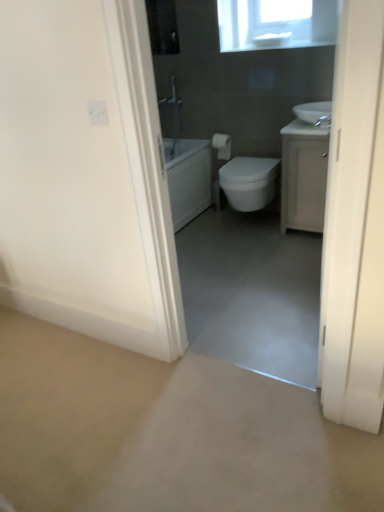
This screenshot has height=512, width=384. What do you see at coordinates (222, 146) in the screenshot?
I see `white matte toilet paper at center` at bounding box center [222, 146].

Looking at this image, measure the distance between point (284, 214) and camera.

Point (284, 214) and camera are 9.69 feet apart.

In order to face white glossy cabinet at right, should I rotate leftwards or rightwards?

It's best to rotate right around 15.674 degrees.

Where is `white matte toilet paper at center`? white matte toilet paper at center is located at coordinates (222, 146).

From the image's perspective, is white matte toilet paper at center under white glossy bidet at center?

Incorrect, from the image's perspective, white matte toilet paper at center is higher than white glossy bidet at center.

Between white matte toilet paper at center and white glossy bidet at center, which one appears on the right side from the viewer's perspective?

white glossy bidet at center is more to the right.

Is white matte toilet paper at center in front of white glossy bidet at center?

No, white matte toilet paper at center is further to the viewer.

Is point (224, 152) farther from camera compared to point (298, 149)?

Yes, point (224, 152) is farther from viewer.

Which of these two, white matte toilet paper at center or white glossy cabinet at right, stands shorter?

Standing shorter between the two is white matte toilet paper at center.

The width and height of the screenshot is (384, 512). What are the coordinates of `bathroom cabinet located on the right of white matte toilet paper at center` in the screenshot? It's located at (304, 175).

What's the angular difference between white matte toilet paper at center and white glossy cabinet at right's facing directions?

They differ by 0.498 degrees in their facing directions.

Considering the relative positions of white glossy sink at upper right and white glossy cabinet at right in the image provided, is white glossy sink at upper right to the left of white glossy cabinet at right from the viewer's perspective?

Correct, you'll find white glossy sink at upper right to the left of white glossy cabinet at right.

Can you confirm if white glossy sink at upper right is taller than white glossy cabinet at right?

Incorrect, the height of white glossy sink at upper right is not larger of that of white glossy cabinet at right.

This screenshot has width=384, height=512. Find the location of `sink in front of the white glossy cabinet at right`. sink in front of the white glossy cabinet at right is located at coordinates (312, 111).

Is white glossy cabinet at right surrounding white glossy sink at upper right?

No, white glossy sink at upper right is located outside of white glossy cabinet at right.

Identify the location of sink above the white glossy cabinet at right (from a real-world perspective). click(312, 111).

Considering the sizes of objects white glossy cabinet at right and white glossy sink at upper right in the image provided, who is wider, white glossy cabinet at right or white glossy sink at upper right?

Wider between the two is white glossy cabinet at right.

Is white glossy cabinet at right taller or shorter than white glossy sink at upper right?

In the image, white glossy cabinet at right appears to be taller than white glossy sink at upper right.

From the image's perspective, is white glossy bidet at center located above white glossy sink at upper right?

No, from the image's perspective, white glossy bidet at center is not over white glossy sink at upper right.

Between white glossy bidet at center and white glossy sink at upper right, which one is positioned in front?

white glossy sink at upper right is more forward.

Could you tell me if white glossy bidet at center is turned towards white glossy sink at upper right?

No, white glossy bidet at center is not oriented towards white glossy sink at upper right.

Which is correct: white glossy bidet at center is inside white glossy sink at upper right, or outside of it?

white glossy bidet at center is not inside white glossy sink at upper right, it's outside.

Considering the sizes of objects smooth concrete floor at center and white glossy cabinet at right in the image provided, who is wider, smooth concrete floor at center or white glossy cabinet at right?

Wider between the two is smooth concrete floor at center.

In the image, is smooth concrete floor at center positioned in front of or behind white glossy cabinet at right?

In the image, smooth concrete floor at center appears in front of white glossy cabinet at right.

From their relative heights in the image, would you say smooth concrete floor at center is taller or shorter than white glossy cabinet at right?

Clearly, smooth concrete floor at center is shorter compared to white glossy cabinet at right.

How many degrees apart are the facing directions of smooth concrete floor at center and white glossy cabinet at right?

91.3 degrees.

From the image's perspective, is smooth concrete floor at center located above or below white glossy bidet at center?

From the image's perspective, smooth concrete floor at center appears below white glossy bidet at center.

Is smooth concrete floor at center behind white glossy bidet at center?

No.

Does smooth concrete floor at center touch white glossy bidet at center?

No, smooth concrete floor at center is not making contact with white glossy bidet at center.

From their relative heights in the image, would you say smooth concrete floor at center is taller or shorter than white glossy bidet at center?

Considering their sizes, smooth concrete floor at center has less height than white glossy bidet at center.

Identify the location of bidet on the right side of white matte toilet paper at center. The width and height of the screenshot is (384, 512). click(x=249, y=182).

Find the location of a particular element. This screenshot has width=384, height=512. toilet paper above the white glossy cabinet at right (from the image's perspective) is located at coordinates (222, 146).

Considering their positions, is white glossy cabinet at right positioned further to white glossy bidet at center than white matte toilet paper at center?

white matte toilet paper at center.

Which object lies nearer to the anchor point white glossy sink at upper right, white glossy cabinet at right or white glossy bidet at center?

Among the two, white glossy cabinet at right is located nearer to white glossy sink at upper right.

From the picture: When comparing their distances from white glossy bidet at center, does white glossy sink at upper right or white matte toilet paper at center seem further?

Among the two, white glossy sink at upper right is located further to white glossy bidet at center.

Which object lies further to the anchor point white glossy bidet at center, smooth concrete floor at center or white matte toilet paper at center?

The object further to white glossy bidet at center is smooth concrete floor at center.

Which object lies further to the anchor point white matte toilet paper at center, white glossy sink at upper right or white glossy bidet at center?

Among the two, white glossy sink at upper right is located further to white matte toilet paper at center.

Which object lies further to the anchor point white glossy sink at upper right, white glossy bidet at center or white matte toilet paper at center?

white matte toilet paper at center.

Which object lies further to the anchor point white glossy bidet at center, white matte toilet paper at center or white glossy cabinet at right?

white matte toilet paper at center lies further to white glossy bidet at center than the other object.

Based on their spatial positions, is white glossy sink at upper right or white glossy cabinet at right closer to smooth concrete floor at center?

white glossy cabinet at right is closer to smooth concrete floor at center.

At what (x,y) coordinates should I click in order to perform the action: click on bathroom cabinet between smooth concrete floor at center and white glossy bidet at center in the front-back direction. Please return your answer as a coordinate pair (x, y). This screenshot has height=512, width=384. Looking at the image, I should click on (304, 175).

The height and width of the screenshot is (512, 384). In order to click on bathroom cabinet located between smooth concrete floor at center and white matte toilet paper at center in the depth direction in this screenshot , I will do `click(304, 175)`.

Image resolution: width=384 pixels, height=512 pixels. In order to click on bathroom cabinet positioned between white glossy sink at upper right and white matte toilet paper at center from near to far in this screenshot , I will do `click(304, 175)`.

I want to click on sink positioned between smooth concrete floor at center and white matte toilet paper at center from near to far, so click(312, 111).